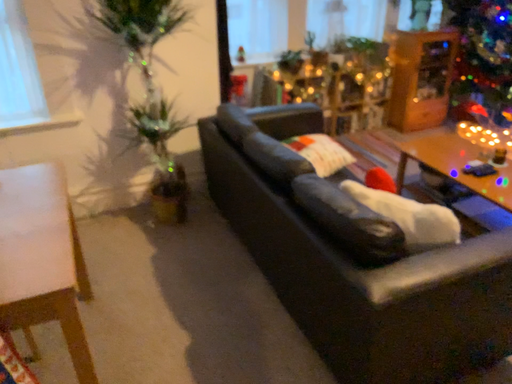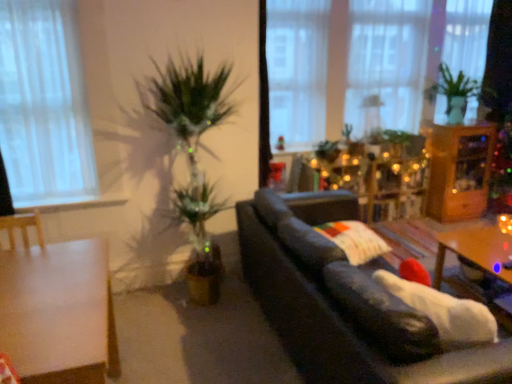
Question: How did the camera likely rotate when shooting the video?

Choices:
 (A) rotated upward
 (B) rotated downward

Answer: (A)